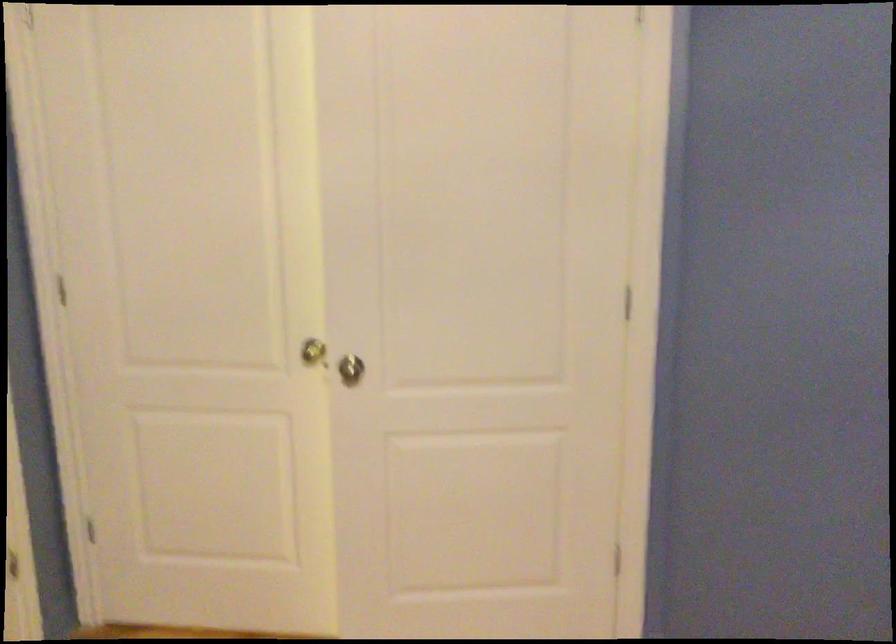
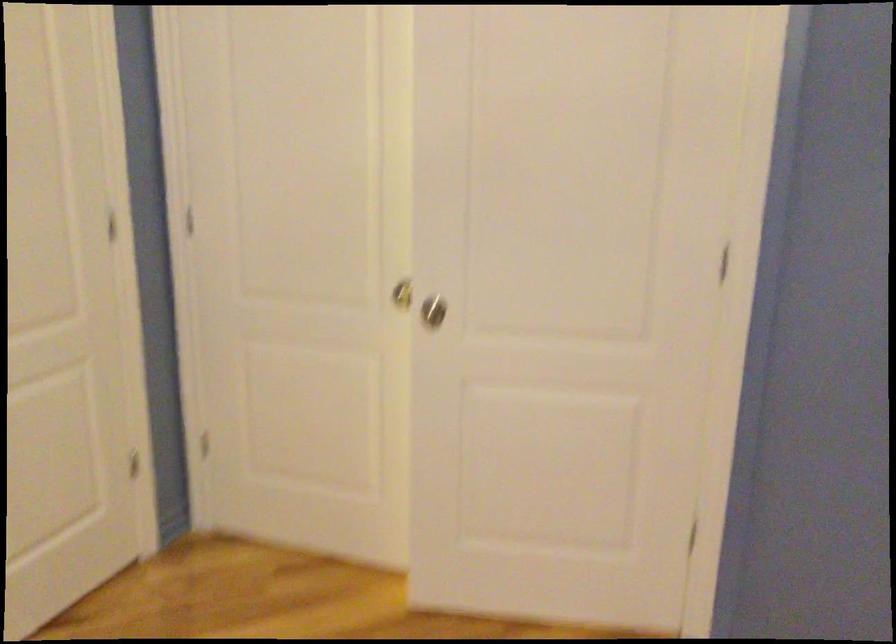
Find the pixel in the second image that matches [312,348] in the first image.

(401, 292)